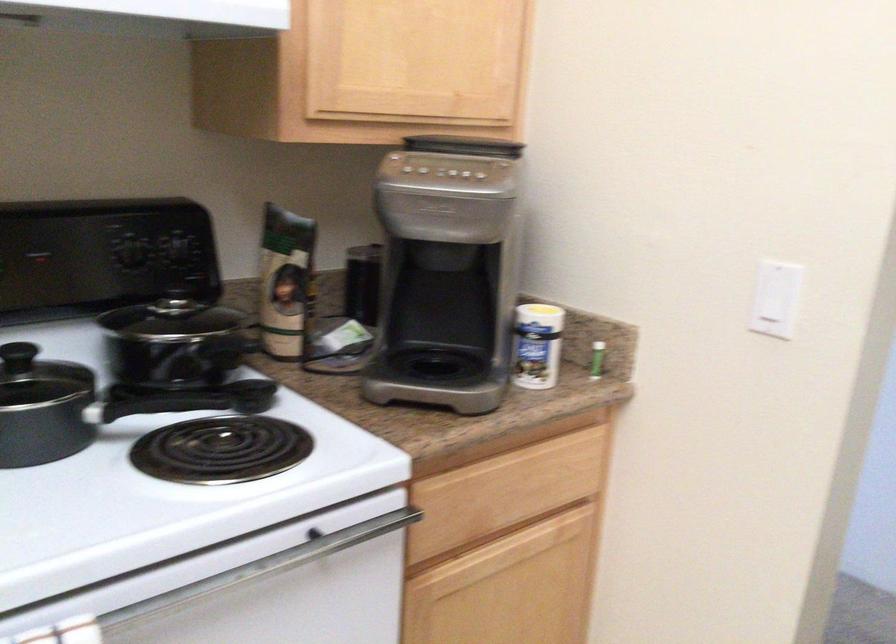
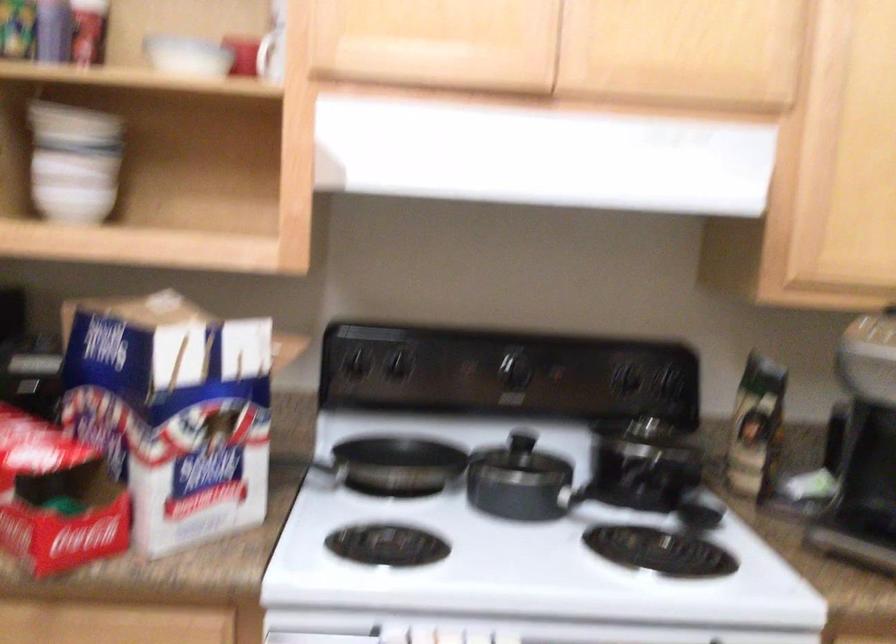
The point at (291, 285) is marked in the first image. Where is the corresponding point in the second image?

(755, 426)